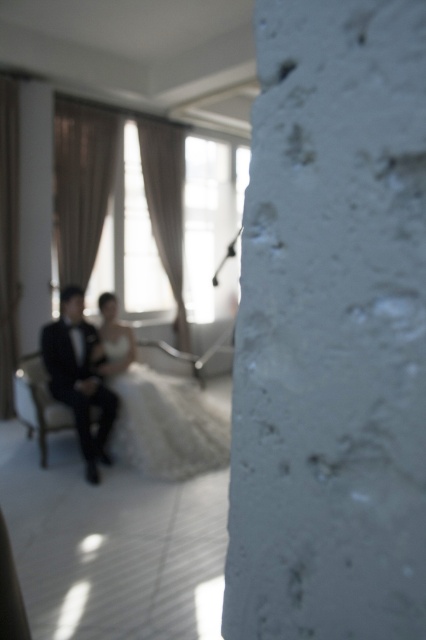
You are a photographer holding a camera that requires a minimum of 14 inches of space to safely operate. You need to position yourself between the white satin dress at center and the black satin suit at left. Is there enough space for you to operate your camera comfortably?

The distance between the white satin dress at center and the black satin suit at left is 13.95 inches, which is slightly less than the required 14 inches. Therefore, there isn not enough space for the photographer to operate the camera comfortably between them.

You are a photographer trying to capture a closeup of the white satin dress at center and the black satin suit at left. Given that your camera can only focus on one subject at a time, which subject should you choose to ensure the larger one is in focus?

The white satin dress at center is larger in size than the black satin suit at left, so you should focus on the white satin dress at center to ensure the larger one is in focus.